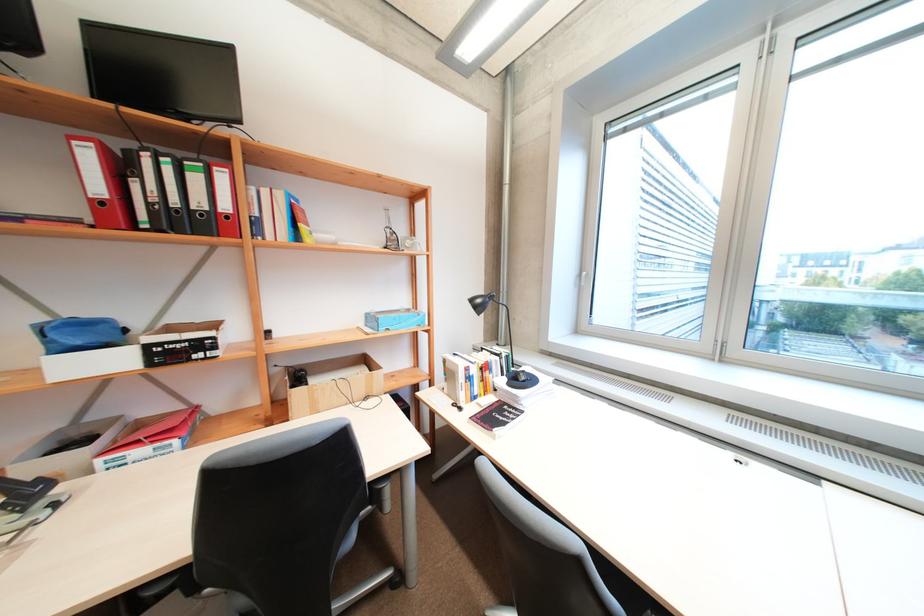
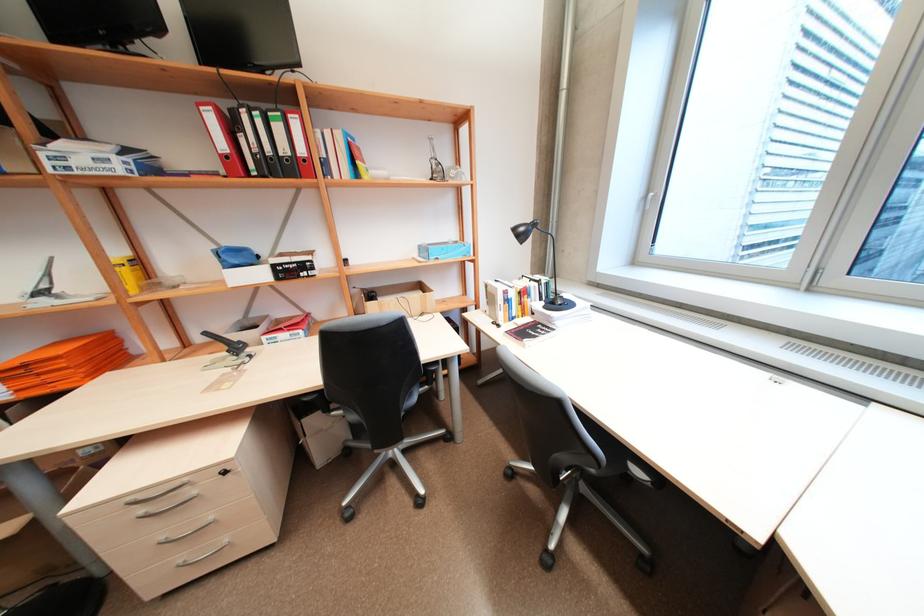
In a continuous first-person perspective shot, in which direction is the camera moving?

The movement direction of the cameraman is right, backward.